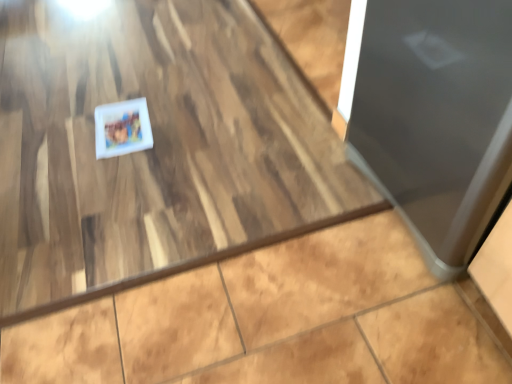
This screenshot has width=512, height=384. What do you see at coordinates (432, 114) in the screenshot?
I see `glossy metallic door at right` at bounding box center [432, 114].

Identify the location of glossy metallic door at right. The height and width of the screenshot is (384, 512). [432, 114].

What is the approximate height of glossy metallic door at right?

glossy metallic door at right is 28.01 inches tall.

Measure the distance between white matte postcard at center and camera.

The distance of white matte postcard at center from camera is 1.58 meters.

Find the location of a particular element. This screenshot has width=512, height=384. white matte postcard at center is located at coordinates [122, 128].

Describe the element at coordinates (122, 128) in the screenshot. I see `white matte postcard at center` at that location.

Where is `glossy metallic door at right`? Image resolution: width=512 pixels, height=384 pixels. glossy metallic door at right is located at coordinates coord(432,114).

Does glossy metallic door at right appear on the right side of white matte postcard at center?

Correct, you'll find glossy metallic door at right to the right of white matte postcard at center.

Considering the relative positions of glossy metallic door at right and white matte postcard at center in the image provided, is glossy metallic door at right behind white matte postcard at center?

No, it is in front of white matte postcard at center.

Between point (375, 159) and point (105, 124), which one is positioned behind?

The point (105, 124) is farther.

From the image's perspective, would you say glossy metallic door at right is positioned over white matte postcard at center?

No, from the image's perspective, glossy metallic door at right is not above white matte postcard at center.

From a real-world perspective, which object stands above the other?

glossy metallic door at right.

Looking at their sizes, would you say glossy metallic door at right is wider or thinner than white matte postcard at center?

glossy metallic door at right is wider than white matte postcard at center.

Which of these two, glossy metallic door at right or white matte postcard at center, stands shorter?

Standing shorter between the two is white matte postcard at center.

Can you confirm if glossy metallic door at right is bigger than white matte postcard at center?

Correct, glossy metallic door at right is larger in size than white matte postcard at center.

Choose the correct answer: Is glossy metallic door at right inside white matte postcard at center or outside it?

glossy metallic door at right cannot be found inside white matte postcard at center.

Can you see glossy metallic door at right touching white matte postcard at center?

glossy metallic door at right is not next to white matte postcard at center, and they're not touching.

Is white matte postcard at center at the back of glossy metallic door at right?

glossy metallic door at right is not turned away from white matte postcard at center.

How many degrees apart are the facing directions of glossy metallic door at right and white matte postcard at center?

There is a 93.1-degree angle between the facing directions of glossy metallic door at right and white matte postcard at center.

You are a GUI agent. You are given a task and a screenshot of the screen. Output one action in this format:
    pyautogui.click(x=<x>, y=<y>)
    Task: Click on the postcard to the left of glossy metallic door at right
    This screenshot has height=384, width=512.
    Given the screenshot: What is the action you would take?
    pyautogui.click(x=122, y=128)

Can you confirm if white matte postcard at center is positioned to the right of glossy metallic door at right?

In fact, white matte postcard at center is to the left of glossy metallic door at right.

Which object is more forward, white matte postcard at center or glossy metallic door at right?

glossy metallic door at right.

Between point (121, 143) and point (362, 14), which one is positioned behind?

The point (121, 143) is farther from the camera.

From the image's perspective, is white matte postcard at center above glossy metallic door at right?

Correct, white matte postcard at center appears higher than glossy metallic door at right in the image.

From a real-world perspective, which object rests below the other?

In real-world perspective, white matte postcard at center is lower.

In terms of width, does white matte postcard at center look wider or thinner when compared to glossy metallic door at right?

Clearly, white matte postcard at center has less width compared to glossy metallic door at right.

In terms of height, does white matte postcard at center look taller or shorter compared to glossy metallic door at right?

Considering their sizes, white matte postcard at center has less height than glossy metallic door at right.

Is white matte postcard at center bigger or smaller than glossy metallic door at right?

In the image, white matte postcard at center appears to be smaller than glossy metallic door at right.

Is white matte postcard at center outside of glossy metallic door at right?

Yes.

Is white matte postcard at center next to glossy metallic door at right?

No, white matte postcard at center is not beside glossy metallic door at right.

Could you tell me if white matte postcard at center is turned towards glossy metallic door at right?

No, white matte postcard at center is not facing towards glossy metallic door at right.

What's the angular difference between white matte postcard at center and glossy metallic door at right's facing directions?

There is a 93.1-degree angle between the facing directions of white matte postcard at center and glossy metallic door at right.

Find the location of a particular element. door that appears above the white matte postcard at center (from a real-world perspective) is located at coordinates (432, 114).

Where is `postcard on the left of glossy metallic door at right`? The height and width of the screenshot is (384, 512). postcard on the left of glossy metallic door at right is located at coordinates (122, 128).

At what (x,y) coordinates should I click in order to perform the action: click on door that appears on the right of white matte postcard at center. Please return your answer as a coordinate pair (x, y). This screenshot has height=384, width=512. Looking at the image, I should click on (432, 114).